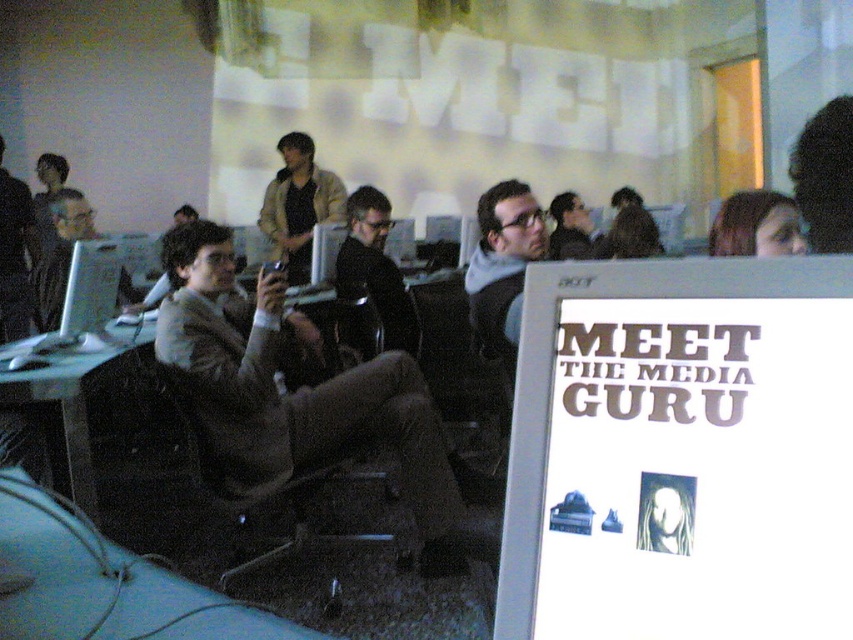
Question: Considering the relative positions of black fabric swivel chair at center and gray sweater at center in the image provided, where is black fabric swivel chair at center located with respect to gray sweater at center?

Choices:
 (A) above
 (B) below

Answer: (B)

Question: Among these points, which one is farthest from the camera?

Choices:
 (A) (372, 234)
 (B) (502, 248)

Answer: (A)

Question: Among these objects, which one is farthest from the camera?

Choices:
 (A) dark brown hair at upper right
 (B) black fabric swivel chair at center
 (C) matte black jacket at left
 (D) white paper sign at center right

Answer: (C)

Question: Observing the image, what is the correct spatial positioning of gray sweater at center in reference to matte black jacket at center?

Choices:
 (A) right
 (B) left

Answer: (A)

Question: Is black fabric swivel chair at center behind matte black jacket at left?

Choices:
 (A) no
 (B) yes

Answer: (A)

Question: Which point is closer to the camera taking this photo?

Choices:
 (A) (244, 618)
 (B) (850, 301)
 (C) (396, 275)
 (D) (775, 230)

Answer: (B)